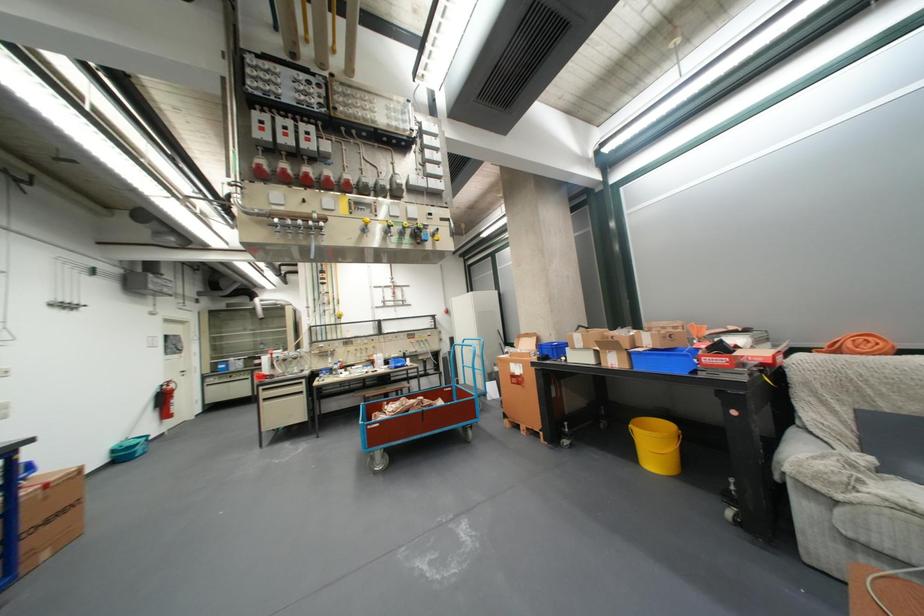
The image size is (924, 616). Identify the location of blue plastic bin. (665, 360).